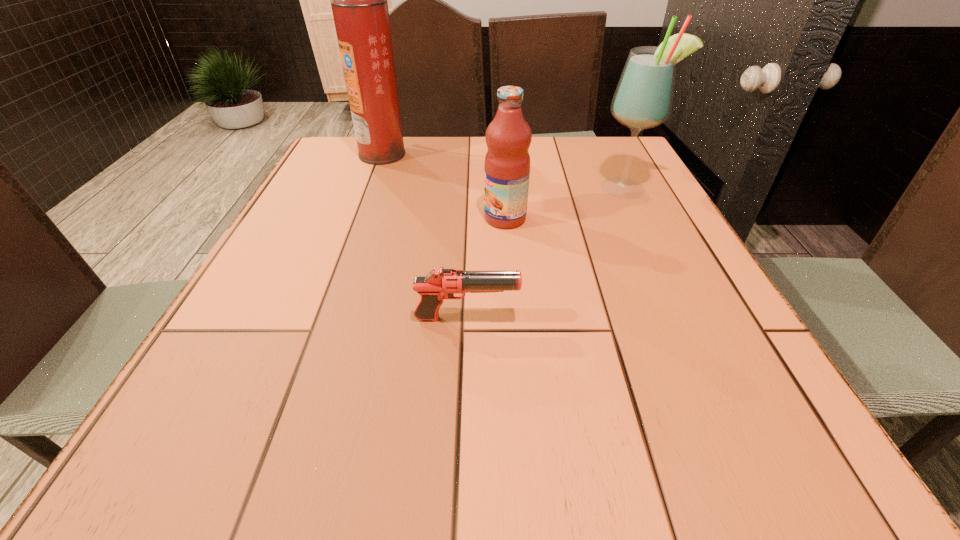
The width and height of the screenshot is (960, 540). Find the location of `blank area at the right edge`. blank area at the right edge is located at coordinates (661, 212).

At what (x,y) coordinates should I click in order to perform the action: click on vacant space at the far right corner of the desktop. Please return your answer as a coordinate pair (x, y). The height and width of the screenshot is (540, 960). Looking at the image, I should click on (600, 167).

Identify the location of free spot at the near right corner of the desktop. This screenshot has width=960, height=540. (778, 470).

This screenshot has width=960, height=540. I want to click on free space between the third shortest object and the second shortest object, so click(565, 204).

Identify the location of unoccupied area between the gun and the fruit juice. (486, 268).

In order to click on empty location between the tallest object and the second shortest object in this screenshot , I will do `click(444, 186)`.

Locate an element on the screen. The width and height of the screenshot is (960, 540). vacant area that lies between the fruit juice and the leftmost object is located at coordinates (444, 186).

Identify the location of empty location between the fruit juice and the farthest object. (444, 186).

The width and height of the screenshot is (960, 540). Identify the location of free space between the third tallest object and the tallest object. (444, 186).

Where is `empty space between the second farthest object and the gun`? The width and height of the screenshot is (960, 540). empty space between the second farthest object and the gun is located at coordinates (546, 254).